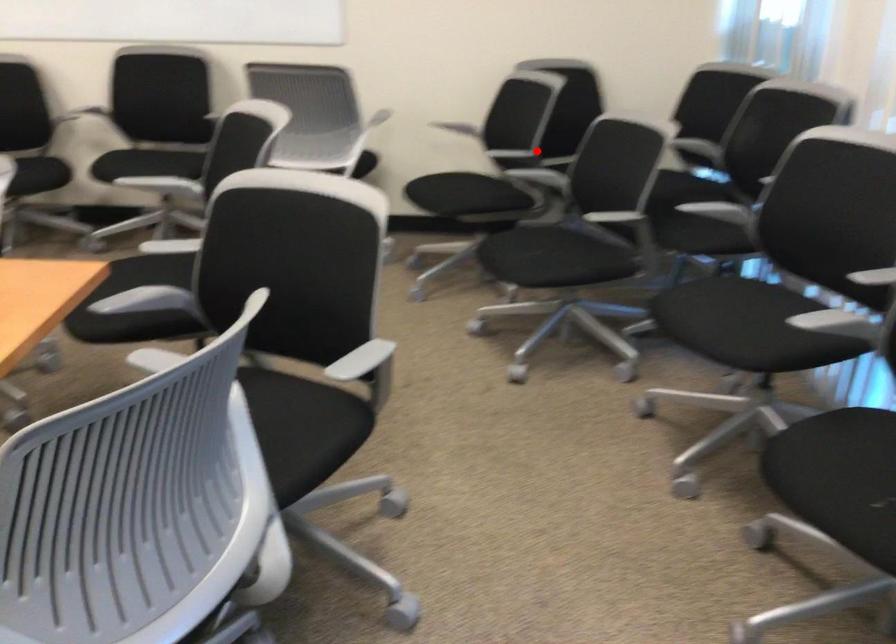
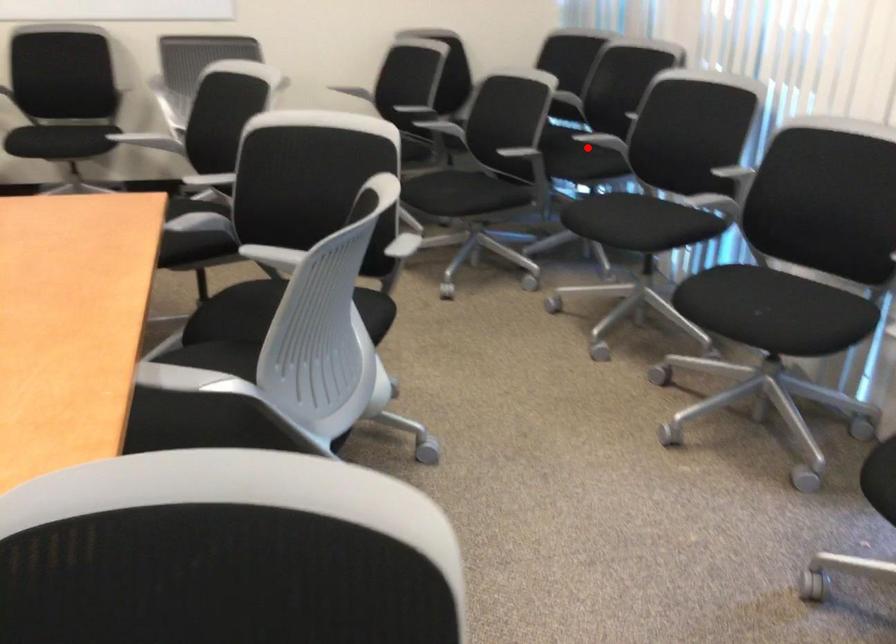
I am providing you with two images of the same scene from different viewpoints. A red point is marked on the first image and another point is marked on the second image. Is the red point in image1 aligned with the point shown in image2?

No